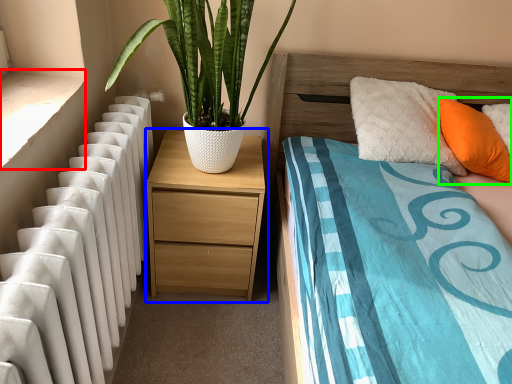
Question: Considering the real-world distances, which object is farthest from window sill (highlighted by a red box)? nightstand (highlighted by a blue box) or pillow (highlighted by a green box)?

Choices:
 (A) nightstand
 (B) pillow

Answer: (B)